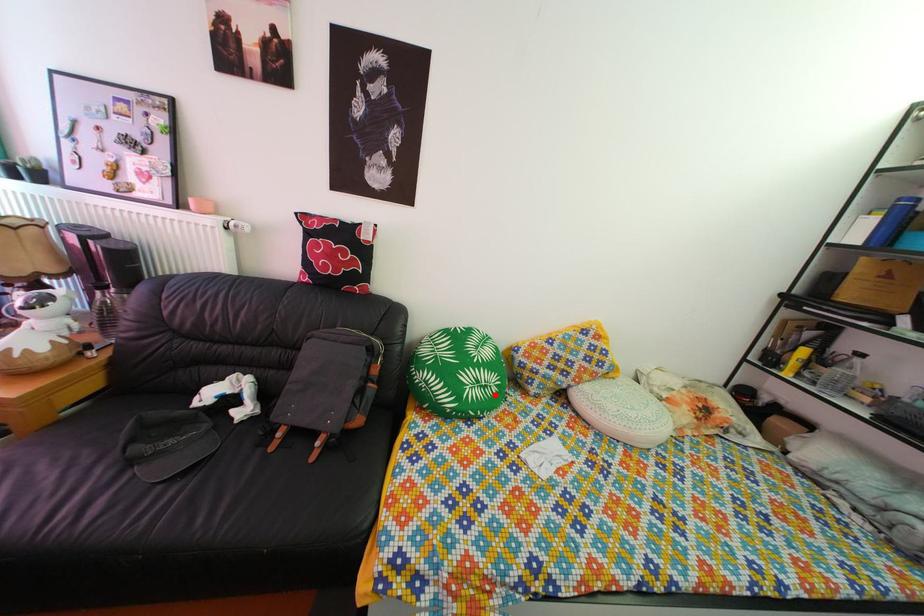
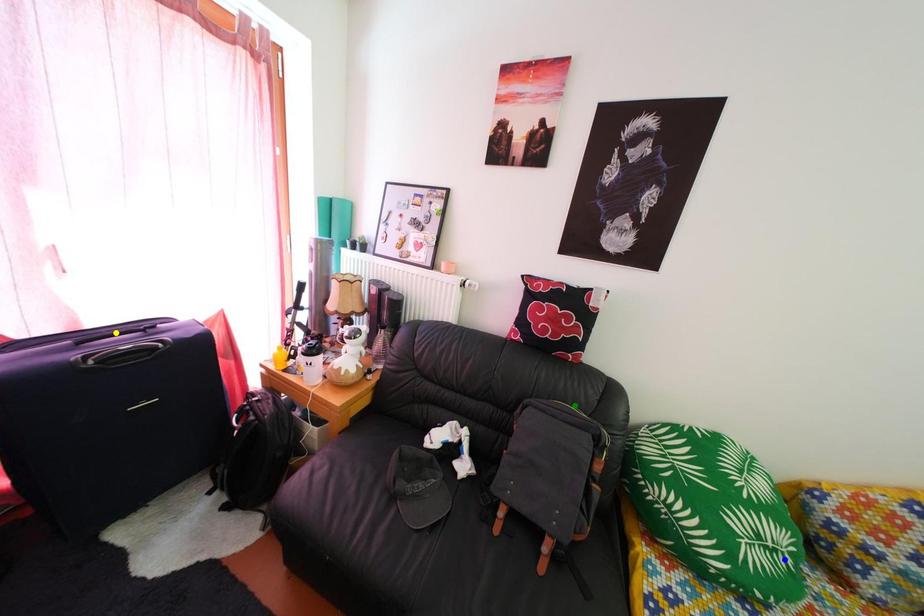
Question: I am providing you with two images of the same scene from different viewpoints. A red point is marked on the first image. You are given multiple points on the second image. Can you choose the point in image 2 that corresponds to the point in image 1?

Choices:
 (A) green point
 (B) yellow point
 (C) blue point

Answer: (C)